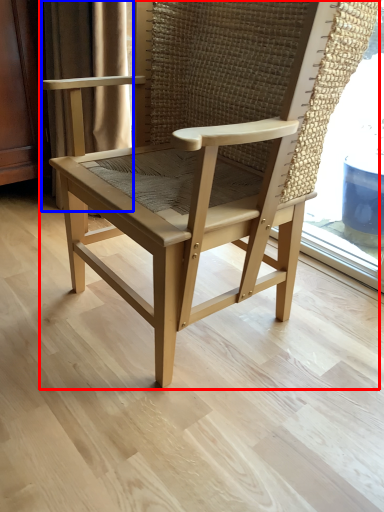
Question: Which of the following is the farthest to the observer, chair (highlighted by a red box) or curtain (highlighted by a blue box)?

Choices:
 (A) chair
 (B) curtain

Answer: (B)